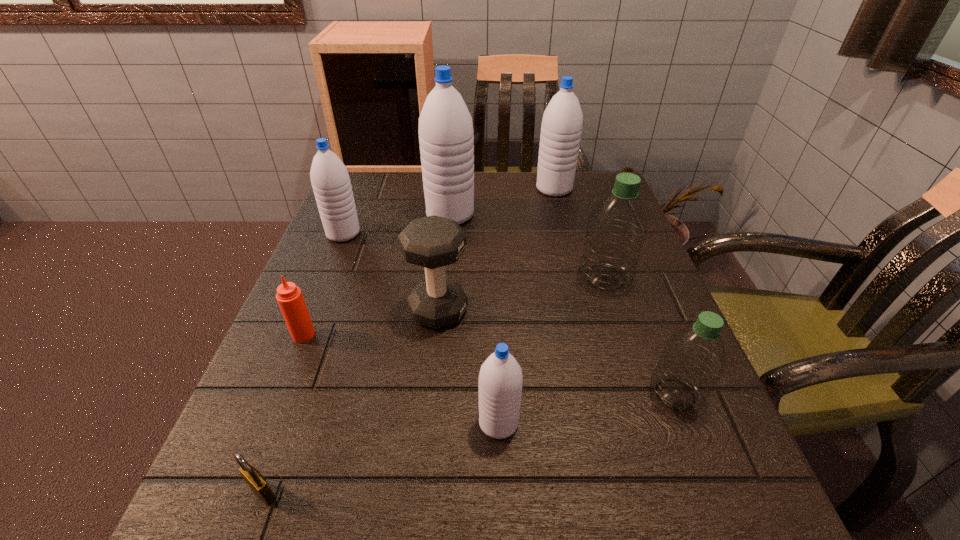
You are a GUI agent. You are given a task and a screenshot of the screen. Output one action in this format:
    pyautogui.click(x=<x>, y=<y>)
    Task: Click on the vacant point located between the leftmost water bottle and the second shortest object
    
    Given the screenshot: What is the action you would take?
    pyautogui.click(x=324, y=284)

Where is `vacant space that's between the farther green water bottle and the fifth water bottle from right to left`? vacant space that's between the farther green water bottle and the fifth water bottle from right to left is located at coordinates [x=528, y=246].

In order to click on free spot between the smallest blue water bottle and the leftmost water bottle in this screenshot , I will do `click(421, 328)`.

The width and height of the screenshot is (960, 540). I want to click on object that stands as the second closest to the eighth tallest object, so click(254, 479).

Locate an element on the screen. This screenshot has height=540, width=960. object that is the third closest to the biggest blue water bottle is located at coordinates (433, 242).

Identify which water bottle is located as the fifth nearest to the third biggest blue water bottle. Please provide its 2D coordinates. Your answer should be formatted as a tuple, i.e. [(x, y)], where the tuple contains the x and y coordinates of a point satisfying the conditions above.

[(692, 360)]

Locate an element on the screen. This screenshot has height=540, width=960. water bottle that is the fifth closest to the smaller green water bottle is located at coordinates (331, 184).

Where is `blue water bottle that is the third closest to the nearest blue water bottle`? blue water bottle that is the third closest to the nearest blue water bottle is located at coordinates (562, 122).

Select which blue water bottle appears as the third closest to the tallest object. Please provide its 2D coordinates. Your answer should be formatted as a tuple, i.e. [(x, y)], where the tuple contains the x and y coordinates of a point satisfying the conditions above.

[(500, 379)]

You are a GUI agent. You are given a task and a screenshot of the screen. Output one action in this format:
    pyautogui.click(x=<x>, y=<y>)
    Task: Click on the vacant area in the image that satisfies the following two spatial constraints: 1. on the front side of the leftmost blue water bottle; 2. on the right side of the smallest blue water bottle
    The height and width of the screenshot is (540, 960).
    Given the screenshot: What is the action you would take?
    pyautogui.click(x=268, y=422)